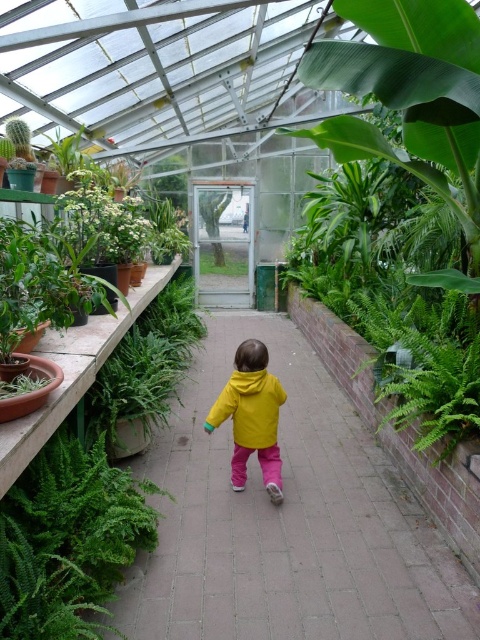
Does yellow fabric at center have a lesser width compared to yellow matte jacket at center?

Incorrect, yellow fabric at center's width is not less than yellow matte jacket at center's.

Is yellow fabric at center positioned before yellow matte jacket at center?

Yes, yellow fabric at center is closer to the viewer.

This screenshot has height=640, width=480. What are the coordinates of `yellow fabric at center` in the screenshot? It's located at (287, 520).

The height and width of the screenshot is (640, 480). Find the location of `yellow fabric at center`. yellow fabric at center is located at coordinates (287, 520).